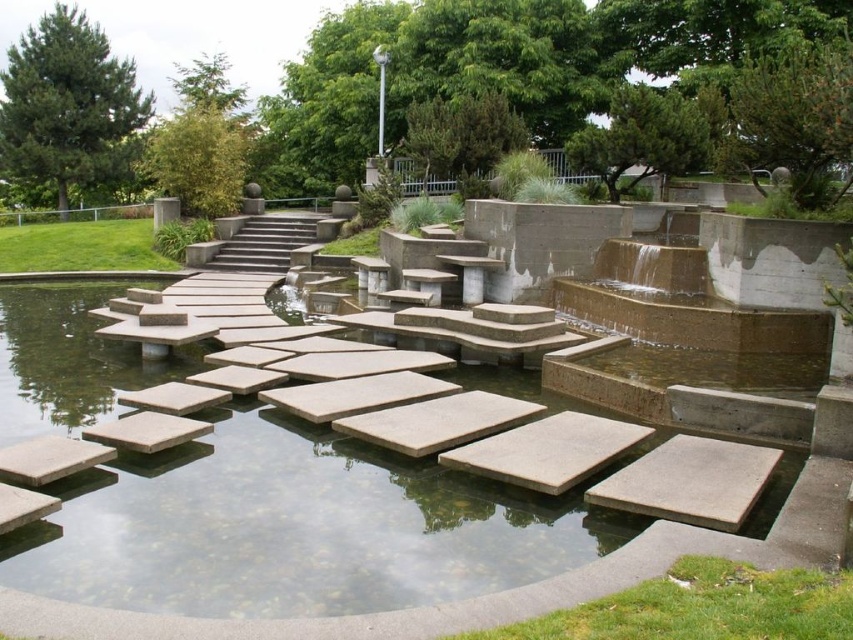
Question: Is smooth concrete pond at center closer to camera compared to concrete stairs at center?

Choices:
 (A) yes
 (B) no

Answer: (A)

Question: Does smooth concrete pond at center appear over concrete stairs at center?

Choices:
 (A) yes
 (B) no

Answer: (B)

Question: Among these points, which one is nearest to the camera?

Choices:
 (A) (273, 241)
 (B) (36, 339)

Answer: (B)

Question: Does smooth concrete pond at center appear on the right side of concrete stairs at center?

Choices:
 (A) no
 (B) yes

Answer: (B)